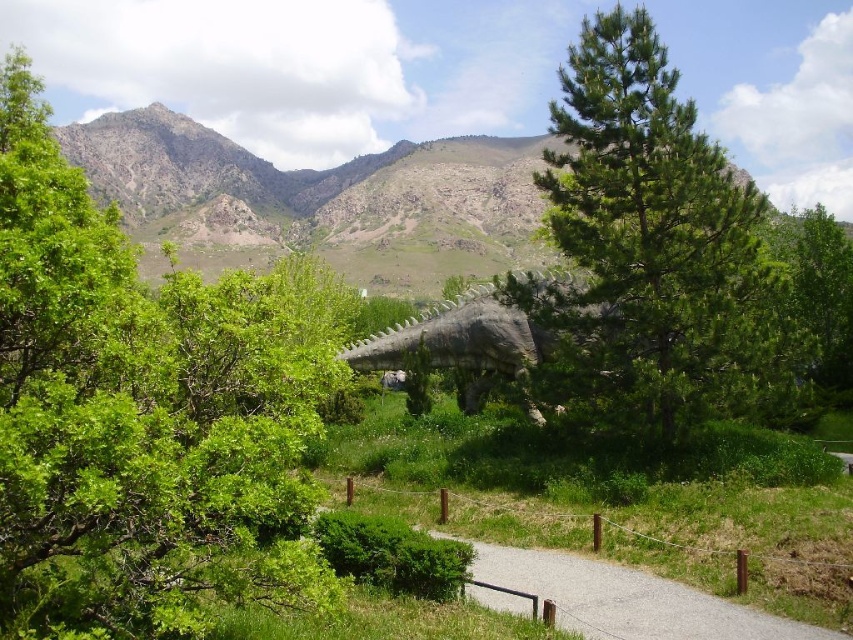
You are standing at the viewpoint and want to reach the point marked as point (675, 358). If your walking speed is 1.5 meters per second, how many seconds will it take you to reach there?

The distance between you and point (675, 358) is 43.20 meters. At a walking speed of 1.5 meters per second, it will take 28.8 seconds to reach there.